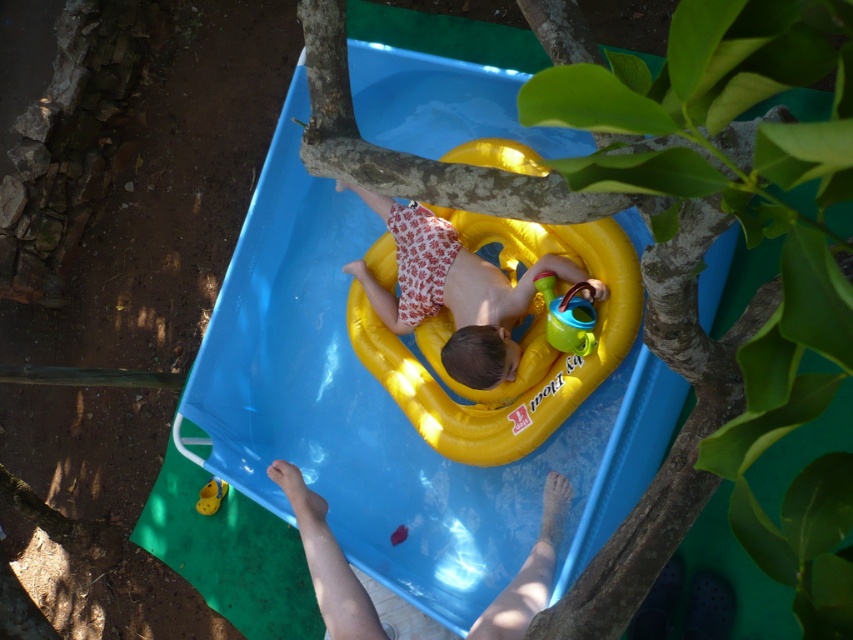
You are a parent supervising a child in the pool. You notice the blue plastic slide at center and the yellow rubber ring at center. Which object is positioned lower in the water?

The blue plastic slide at center is positioned lower in the water than the yellow rubber ring at center.

You are a parent trying to ensure the safety of your child in the pool. The blue plastic slide at center and the yellow rubber ring at center are both in the pool area. Which object is taller and could potentially pose a higher risk of collision for the child?

The blue plastic slide at center is taller than the yellow rubber ring at center, so it could pose a higher risk of collision for the child.